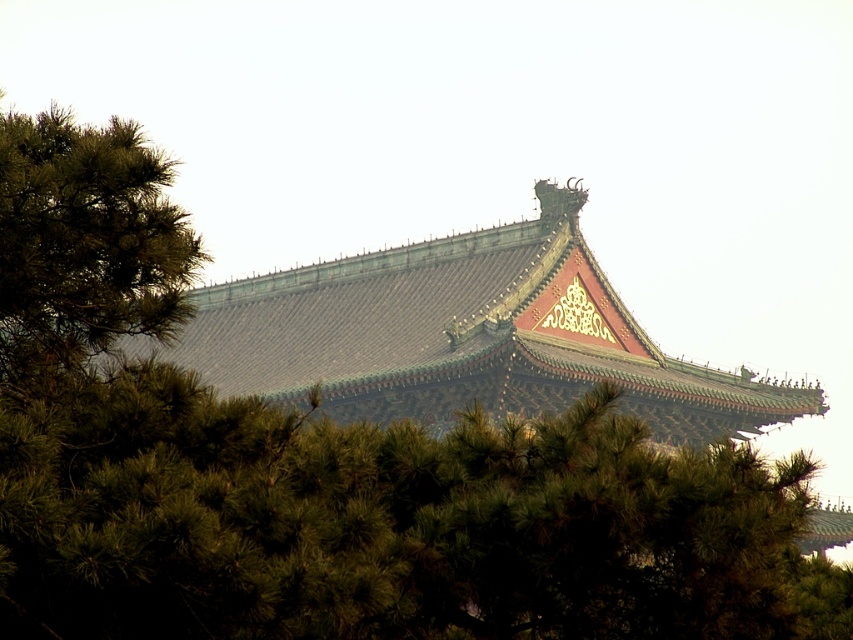
You are an architect designing a garden layout for this temple. You need to place both the green matte pine tree at center and the green leafy tree at left in the garden. Based on their sizes, which tree should be placed closer to the entrance to ensure visibility?

The green matte pine tree at center is taller than the green leafy tree at left, so placing the shorter green leafy tree at left closer to the entrance will ensure it is visible without being overshadowed by the taller pine tree.

You are standing in front of a traditional East Asian temple roof with two points marked on it. You want to know which of the two points, point (457,556) or point (502,241), is closer to you. Can you determine this based on the structure?

Point (457,556) is closer to the camera than point (502,241).